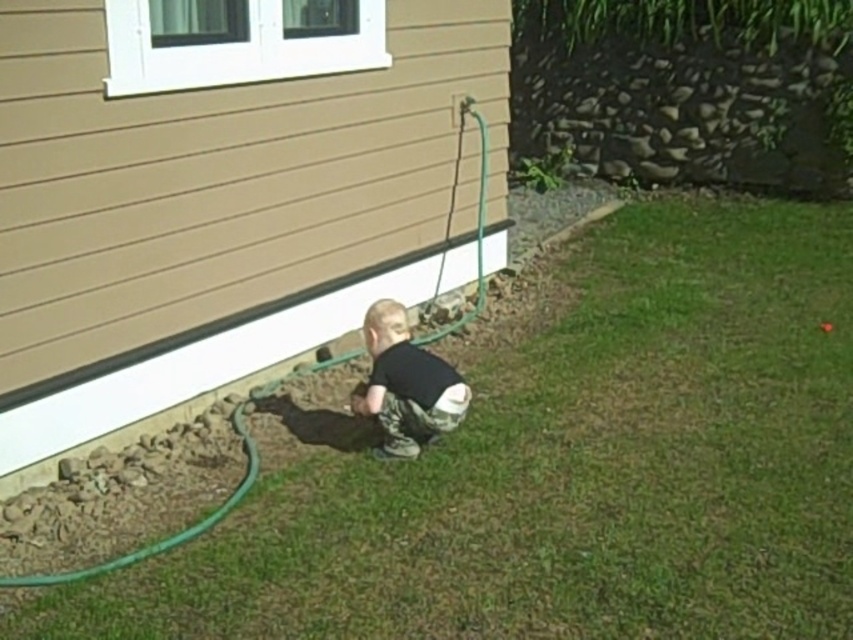
Can you confirm if green grass at lower center is bigger than black matte shirt at center?

Yes, green grass at lower center is bigger than black matte shirt at center.

Who is taller, green grass at lower center or black matte shirt at center?

Standing taller between the two is green grass at lower center.

Which is behind, point (595, 369) or point (367, 390)?

Positioned behind is point (595, 369).

I want to click on green grass at lower center, so click(563, 467).

Consider the image. Does black matte shirt at center have a greater width compared to green rubber hose at lower left?

Correct, the width of black matte shirt at center exceeds that of green rubber hose at lower left.

Is point (374, 369) less distant than point (320, 369)?

Yes, it is in front of point (320, 369).

This screenshot has height=640, width=853. I want to click on black matte shirt at center, so click(x=405, y=385).

Does green grass at lower center lie in front of green rubber hose at lower left?

Yes, green grass at lower center is in front of green rubber hose at lower left.

Between green grass at lower center and green rubber hose at lower left, which one appears on the left side from the viewer's perspective?

Positioned to the left is green rubber hose at lower left.

Is point (212, 568) farther from viewer compared to point (256, 397)?

No, it is not.

Where is `green grass at lower center`? Image resolution: width=853 pixels, height=640 pixels. green grass at lower center is located at coordinates (563, 467).